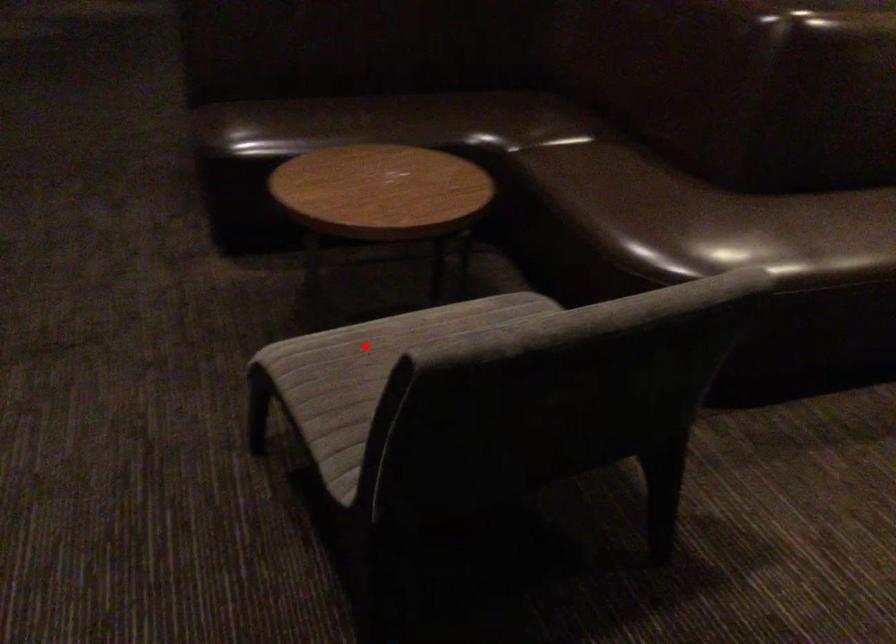
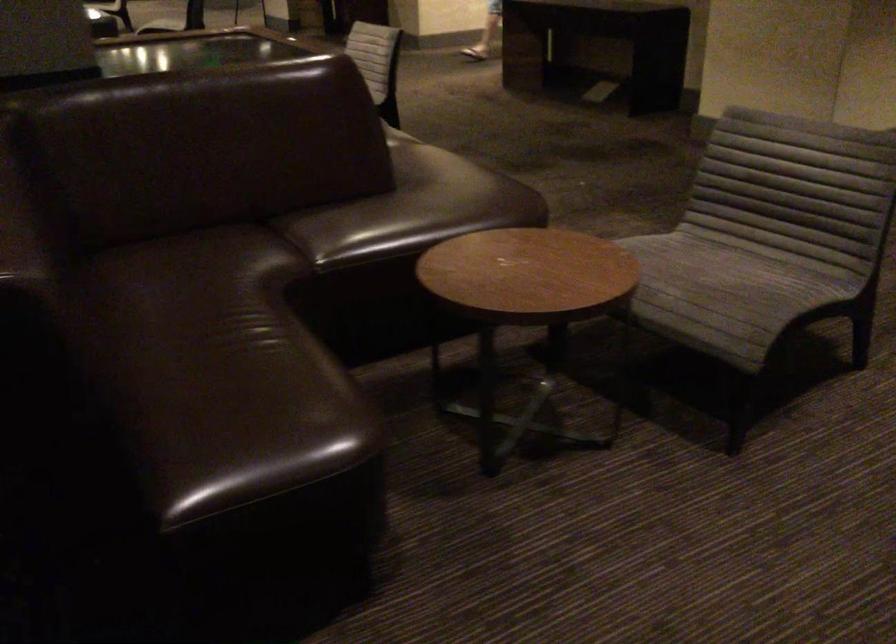
Question: I am providing you with two images of the same scene from different viewpoints. A red point is shown in image1. For the corresponding object point in image2, is it positioned nearer or farther from the camera?

Choices:
 (A) Nearer
 (B) Farther

Answer: (B)